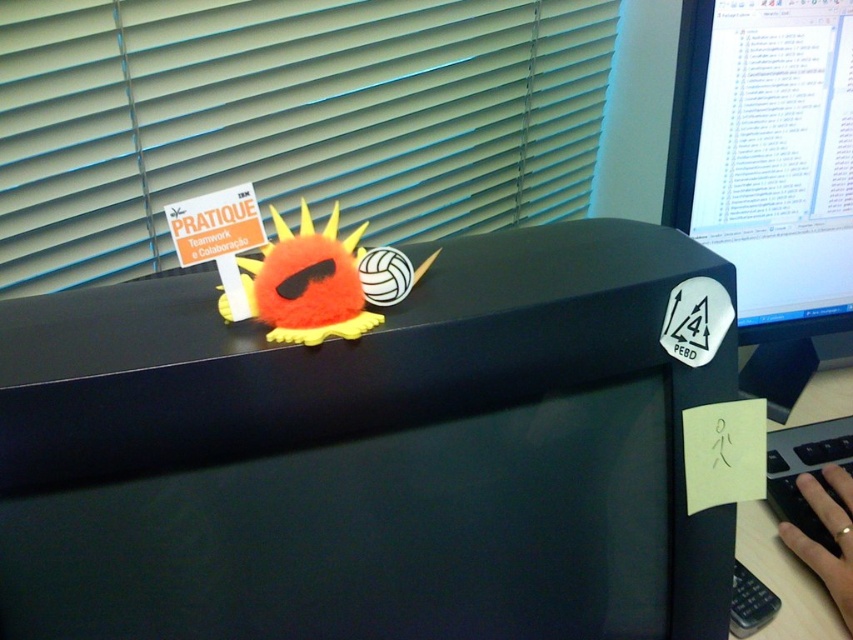
Question: Which point is closer to the camera?

Choices:
 (A) (787, 428)
 (B) (706, 346)
 (C) (798, 621)

Answer: (B)

Question: Which of the following is the farthest from the observer?

Choices:
 (A) black glossy monitor at upper right
 (B) white paper at lower right

Answer: (A)

Question: Does black matte desk at center appear on the right side of white paper at lower right?

Choices:
 (A) no
 (B) yes

Answer: (A)

Question: Is black glossy monitor at upper right to the left of black plastic keyboard at lower right from the viewer's perspective?

Choices:
 (A) yes
 (B) no

Answer: (A)

Question: In this image, where is black matte desk at center located relative to black glossy monitor at upper right?

Choices:
 (A) below
 (B) above

Answer: (A)

Question: Which point appears farthest from the camera in this image?

Choices:
 (A) (666, 182)
 (B) (790, 452)
 (C) (247, 634)
 (D) (312, 113)

Answer: (D)